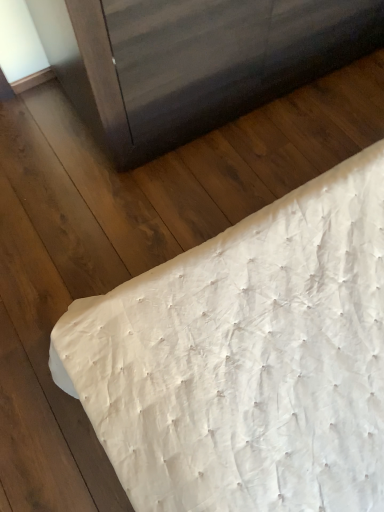
Describe the element at coordinates (247, 359) in the screenshot. The image size is (384, 512). I see `white quilted fabric at lower right` at that location.

Find the location of a particular element. This screenshot has height=512, width=384. white quilted fabric at lower right is located at coordinates (247, 359).

This screenshot has width=384, height=512. In order to click on white quilted fabric at lower right in this screenshot , I will do `click(247, 359)`.